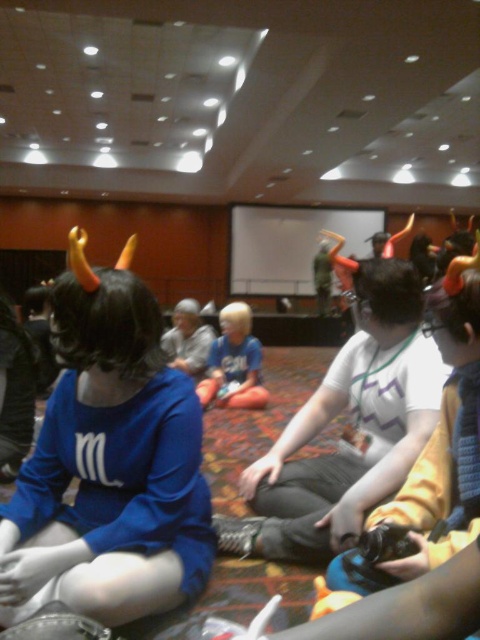
In the image, there is a point marked at coordinates (108, 465). Which object from the scene is located exactly at this point?

The point at (108, 465) marks the location of the matte blue shirt at center.

You are organizing a photo shoot and need to arrange two models wearing the matte blue shirt at center and light blue fabric shirt at center so that they are side by side. Based on their current positions, which model should move to the right to make space?

The matte blue shirt at center should move to the right since it is currently on the left side of the light blue fabric shirt at center, so moving it right would allow them to be side by side without overlapping.

You are organizing a photo shoot and need to position two models wearing the matte blue shirt at center and the light blue fabric shirt at center side by side. Based on their clothing widths, which model should stand on the left to ensure the wider shirt is more visible?

The light blue fabric shirt at center should stand on the left because it has a greater width than the matte blue shirt at center, making it more visible when placed on the left side.